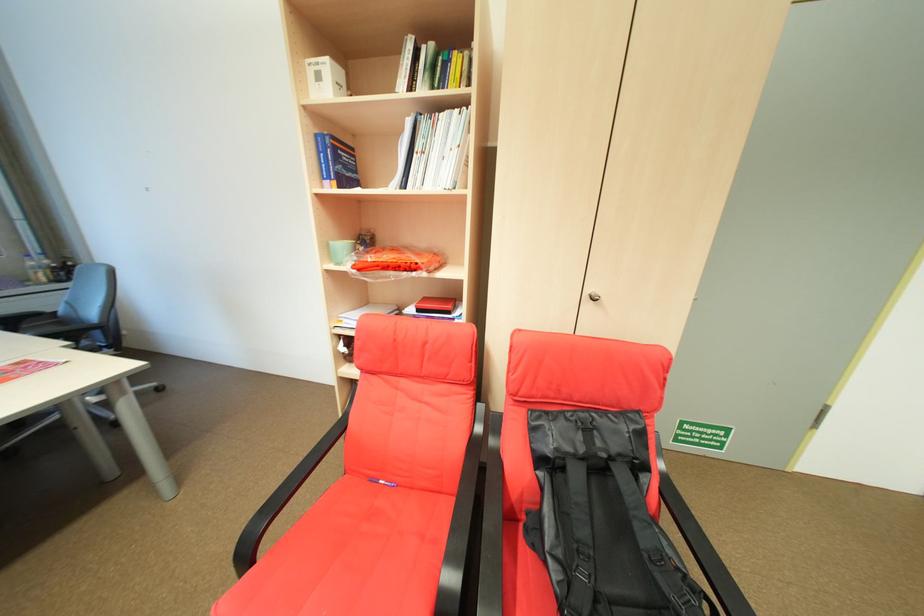
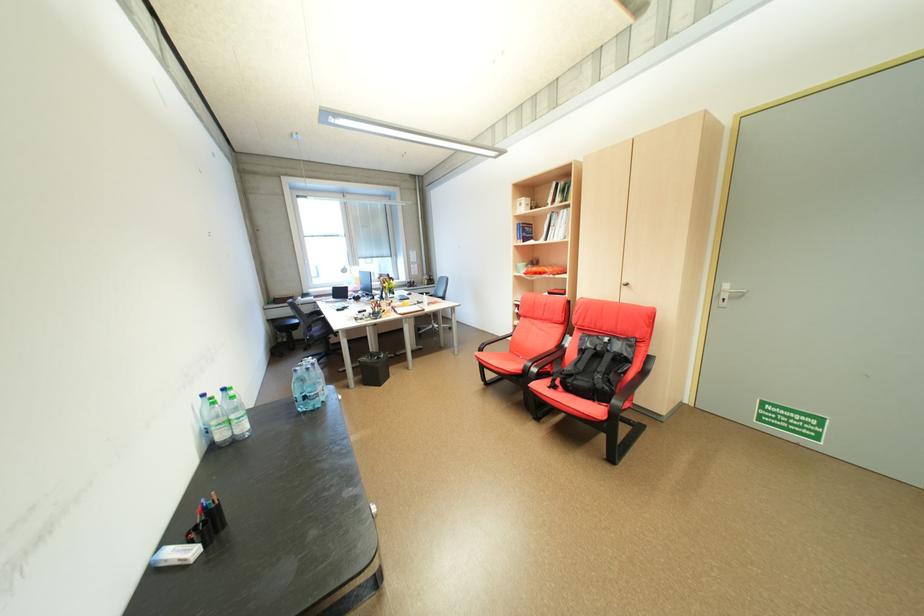
Find the pixel in the second image that matches point 541,430 in the first image.

(590, 339)